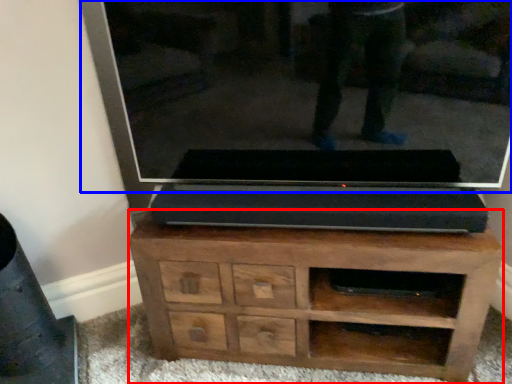
Question: Which object is further to the camera taking this photo, chest of drawers (highlighted by a red box) or glass door (highlighted by a blue box)?

Choices:
 (A) chest of drawers
 (B) glass door

Answer: (A)